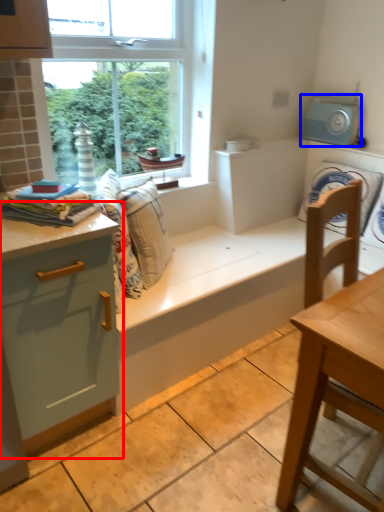
Question: Among these objects, which one is farthest to the camera, dresser (highlighted by a red box) or appliance (highlighted by a blue box)?

Choices:
 (A) dresser
 (B) appliance

Answer: (B)